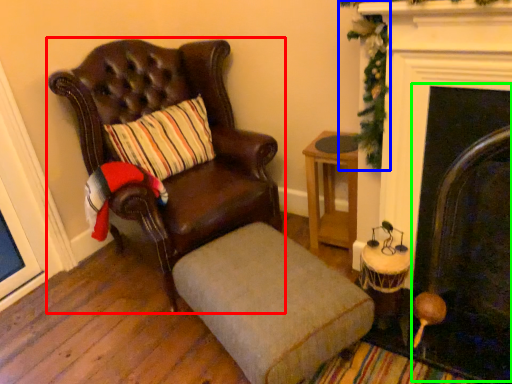
Question: Estimate the real-world distances between objects in this image. Which object is farther from chair (highlighted by a red box), christmas decoration (highlighted by a blue box) or fireplace (highlighted by a green box)?

Choices:
 (A) christmas decoration
 (B) fireplace

Answer: (B)